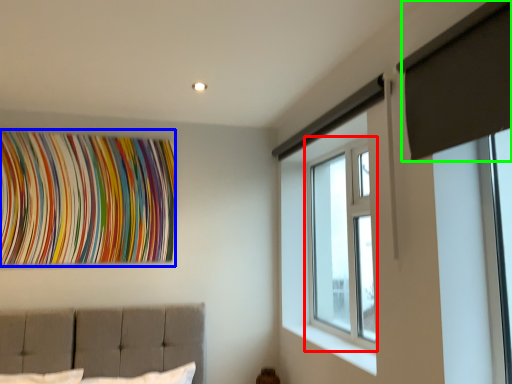
Question: Based on their relative distances, which object is nearer to window (highlighted by a red box)? Choose from tapestry (highlighted by a blue box) and curtain (highlighted by a green box).

Choices:
 (A) tapestry
 (B) curtain

Answer: (B)